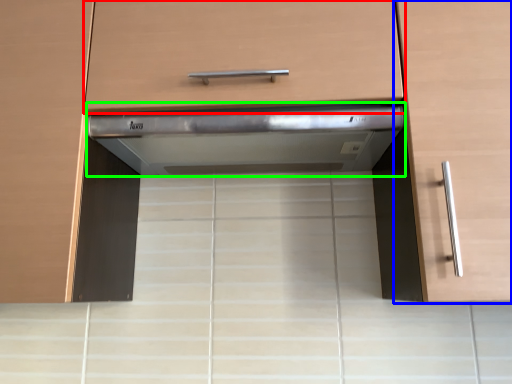
Question: Estimate the real-world distances between objects in this image. Which object is closer to drawer (highlighted by a red box), cabinetry (highlighted by a blue box) or home appliance (highlighted by a green box)?

Choices:
 (A) cabinetry
 (B) home appliance

Answer: (B)